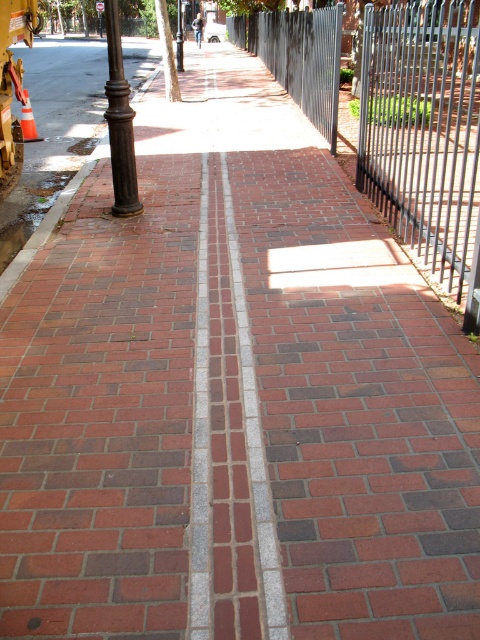
In the scene shown: You are a pedestrian standing on the sidewalk looking towards the street sign. Which object is closer to you, the black metal fence at right or the metallic street sign at upper center?

The black metal fence at right is closer to you as it is positioned in front of the metallic street sign at upper center.

You are a delivery person trying to navigate a narrow sidewalk. You see the black metal fence at right and the metallic street sign at upper center. Which object is wider, potentially making it harder to pass through the narrow space?

The black metal fence at right might be wider than the metallic street sign at upper center, so it could be harder to pass through the narrow space.

You are a pedestrian standing on the sidewalk and want to walk from the black metal pole at center to the metallic street sign at upper center. Which direction should you face to move towards it?

You should face to the left because the metallic street sign at upper center is located to the left of the black metal pole at center.